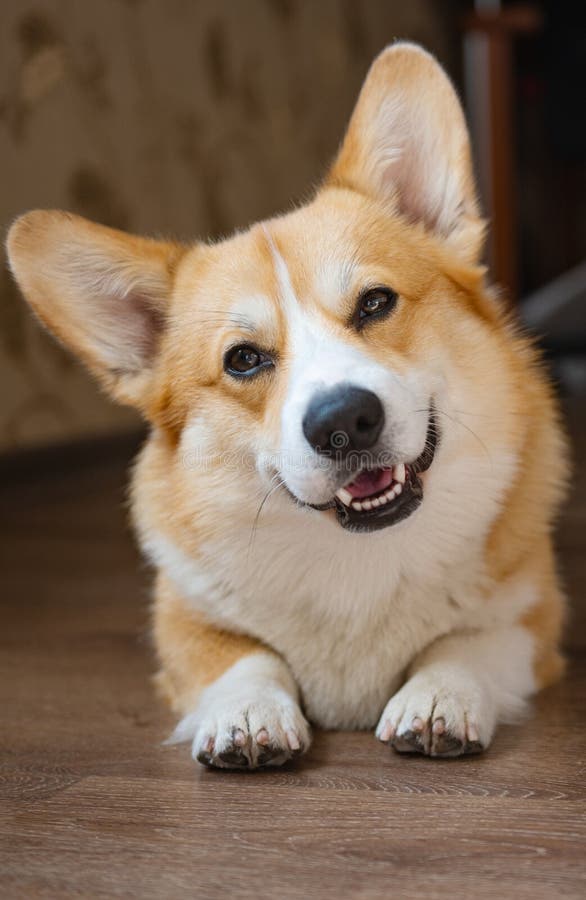
Where is `wooden leg of table`? This screenshot has width=586, height=900. wooden leg of table is located at coordinates (494, 104).